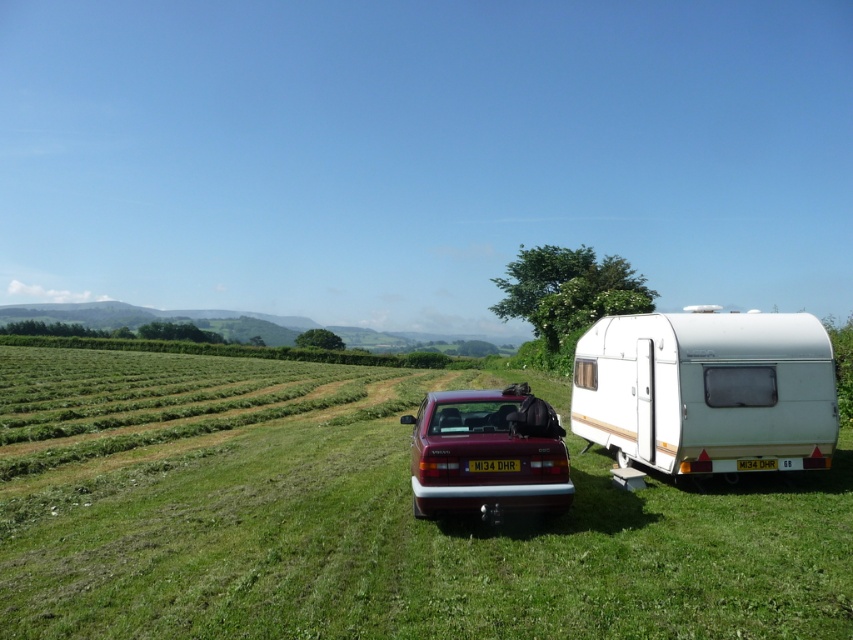
Question: Estimate the real-world distances between objects in this image. Which object is farther from the white matte caravan at right?

Choices:
 (A) maroon metallic car at center
 (B) matte red car at center

Answer: (A)

Question: Among these points, which one is nearest to the camera?

Choices:
 (A) (514, 584)
 (B) (526, 388)
 (C) (577, 422)

Answer: (A)

Question: Which point is farther to the camera?

Choices:
 (A) matte red car at center
 (B) maroon metallic car at center

Answer: (A)

Question: Can you confirm if maroon metallic car at center is smaller than matte red car at center?

Choices:
 (A) yes
 (B) no

Answer: (B)

Question: Is white matte caravan at right smaller than matte red car at center?

Choices:
 (A) yes
 (B) no

Answer: (B)

Question: Can you confirm if maroon metallic car at center is positioned to the right of white matte caravan at right?

Choices:
 (A) no
 (B) yes

Answer: (A)